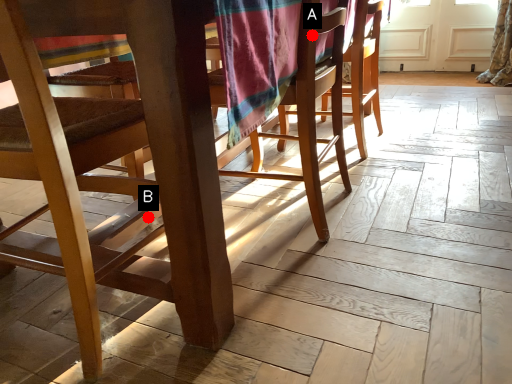
Question: Two points are circled on the image, labeled by A and B beside each circle. Which point appears farthest from the camera in this image?

Choices:
 (A) A is further
 (B) B is further

Answer: (B)